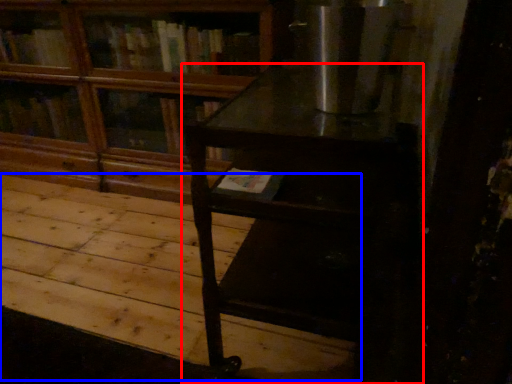
Question: Which point is closer to the camera, table (highlighted by a red box) or plywood (highlighted by a blue box)?

Choices:
 (A) table
 (B) plywood

Answer: (A)